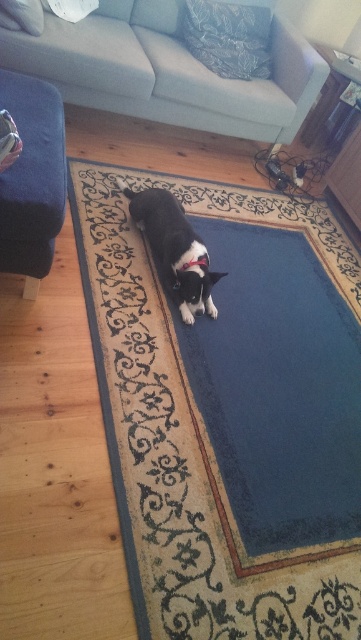
Question: Which object appears farthest from the camera in this image?

Choices:
 (A) black fabric neckband at center
 (B) light gray fabric couch at upper center
 (C) black fur dog at center
 (D) pink fabric neckband at center

Answer: (B)

Question: Among these points, which one is farthest from the camera?

Choices:
 (A) (201, 256)
 (B) (177, 282)

Answer: (B)

Question: Which object is farther from the camera taking this photo?

Choices:
 (A) pink fabric neckband at center
 (B) velvet dark blue ottoman at left
 (C) black fabric neckband at center
 (D) black fur dog at center

Answer: (C)

Question: In this image, where is black fur dog at center located relative to pink fabric neckband at center?

Choices:
 (A) below
 (B) above

Answer: (B)

Question: Is blue carpet at center below black fabric neckband at center?

Choices:
 (A) yes
 (B) no

Answer: (A)

Question: Can you confirm if blue carpet at center is smaller than pink fabric neckband at center?

Choices:
 (A) no
 (B) yes

Answer: (A)